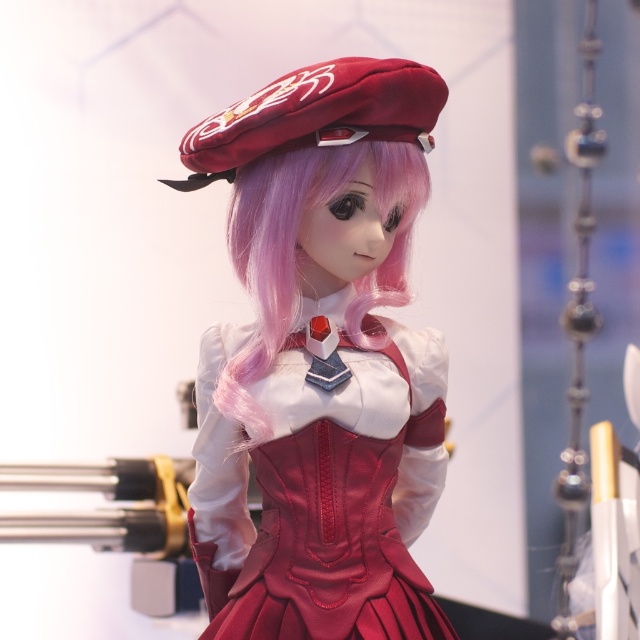
You are a photographer adjusting the focus on a camera lens. The scene shows a doll with a red beret and a white blouse. There is a point marked at coordinates (x=307, y=252). What object does this point likely correspond to?

The point at coordinates (x=307, y=252) corresponds to the pink silky hair at center.

You are a fashion designer examining the doll and its accessories. You need to determine which beret has a greater height between the matte velvet beret at center and the satin red beret at upper center. Which one is taller?

The matte velvet beret at center is taller than the satin red beret at upper center according to the description.